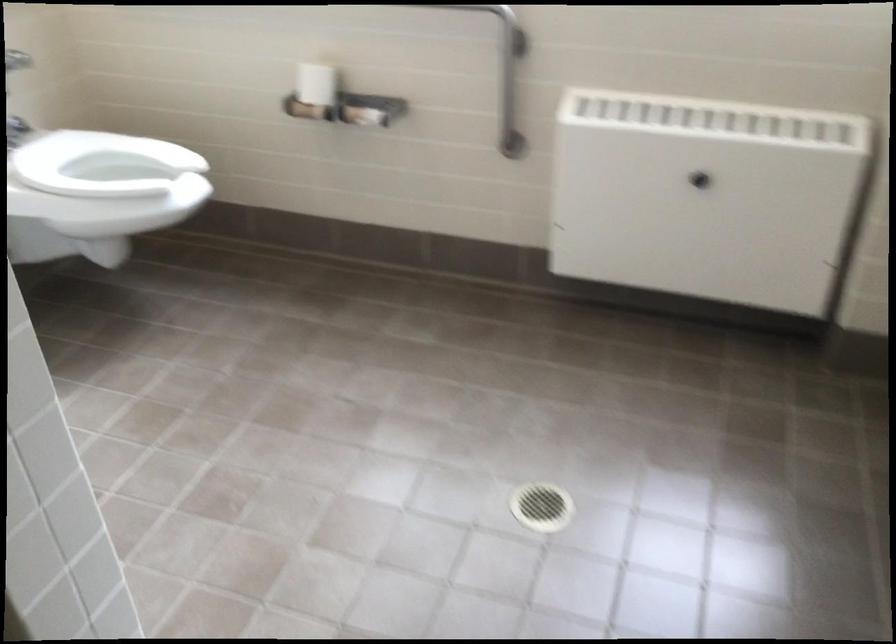
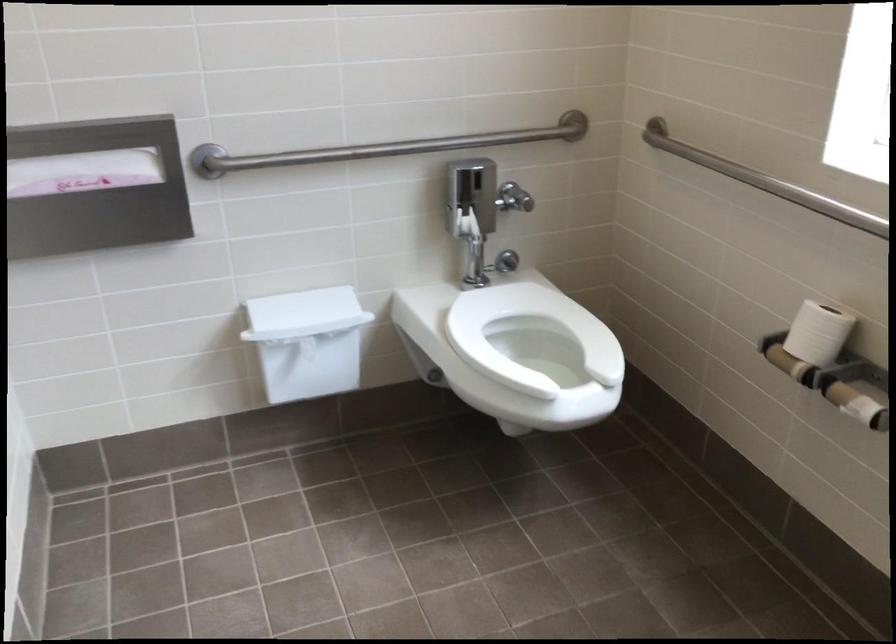
In the second image, find the point that corresponds to pixel 89 185 in the first image.

(530, 335)